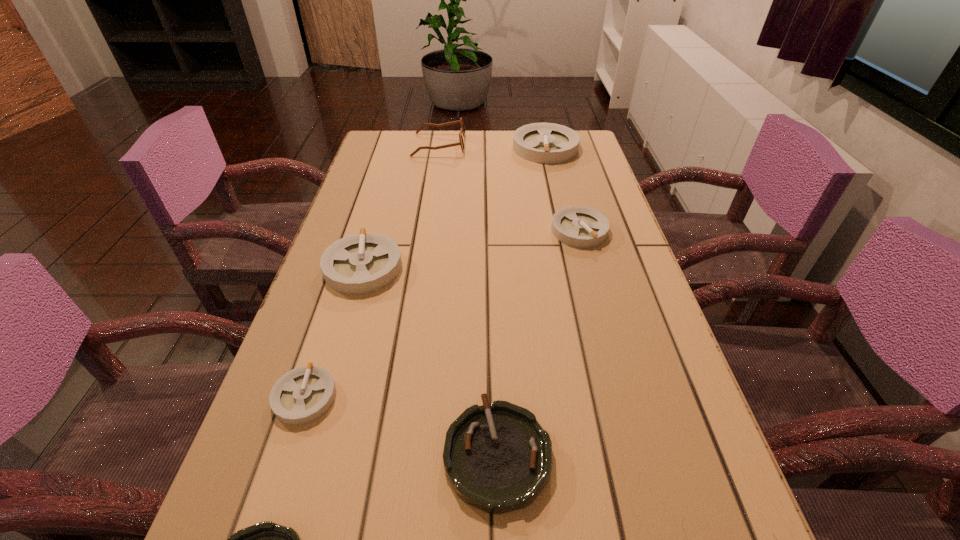
Where is `vacant area situated on the front-facing side of the spectacles`? Image resolution: width=960 pixels, height=540 pixels. vacant area situated on the front-facing side of the spectacles is located at coordinates (486, 145).

This screenshot has height=540, width=960. I want to click on vacant space located on the front of the farthest gray ashtray, so click(x=556, y=193).

Where is `blank space located on the front of the second biggest gray ashtray`? blank space located on the front of the second biggest gray ashtray is located at coordinates (319, 421).

This screenshot has height=540, width=960. In order to click on vacant area situated 0.090m on the back of the third tallest ashtray in this screenshot , I will do `click(570, 195)`.

Where is `free space located 0.160m on the right of the bigger green ashtray`? free space located 0.160m on the right of the bigger green ashtray is located at coordinates (652, 454).

At what (x,y) coordinates should I click in order to perform the action: click on blank space located 0.100m on the back of the nearest gray ashtray. Please return your answer as a coordinate pair (x, y). Looking at the image, I should click on (327, 330).

What are the coordinates of `spectacles that is at the far edge` in the screenshot? It's located at (462, 131).

At what (x,y) coordinates should I click in order to perform the action: click on ashtray that is at the far edge. Please return your answer as a coordinate pair (x, y). The width and height of the screenshot is (960, 540). Looking at the image, I should click on (548, 143).

Where is `spectacles present at the left edge`? The image size is (960, 540). spectacles present at the left edge is located at coordinates (462, 131).

Identify the location of object present at the far left corner. (462, 131).